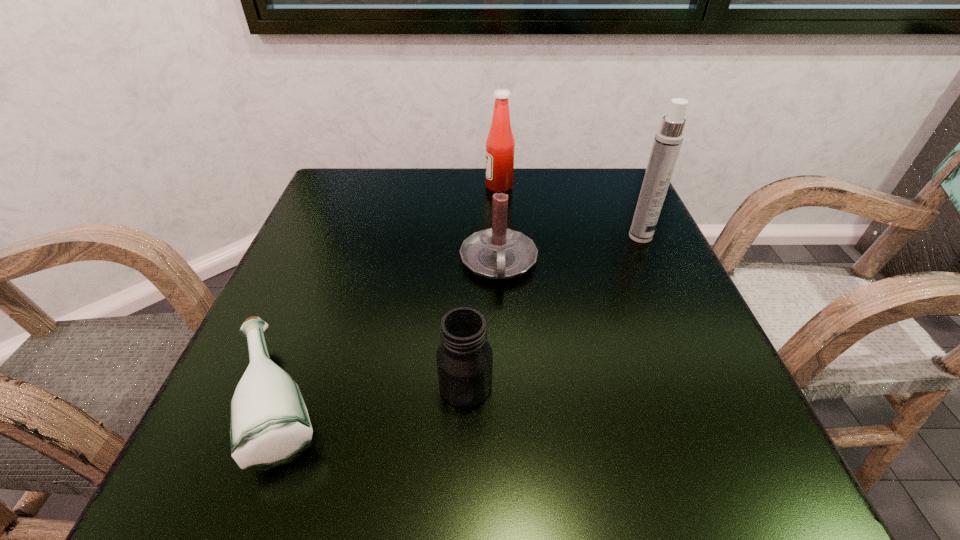
In the image, there is a desktop. At what (x,y) coordinates should I click in order to perform the action: click on free space at the far edge. Please return your answer as a coordinate pair (x, y). The width and height of the screenshot is (960, 540). Looking at the image, I should click on (389, 197).

Image resolution: width=960 pixels, height=540 pixels. I want to click on vacant space at the near edge of the desktop, so click(525, 494).

This screenshot has height=540, width=960. I want to click on vacant space at the left edge, so click(x=307, y=368).

In the image, there is a desktop. In order to click on vacant space at the right edge in this screenshot , I will do `click(606, 231)`.

This screenshot has width=960, height=540. Find the location of `vacant space at the far left corner of the desktop`. vacant space at the far left corner of the desktop is located at coordinates (343, 212).

What are the coordinates of `free spot at the far right corner of the desktop` in the screenshot? It's located at (607, 174).

Image resolution: width=960 pixels, height=540 pixels. In the image, there is a desktop. In order to click on vacant space at the near right corner in this screenshot , I will do `click(749, 469)`.

Find the location of a particular element. free space between the fourth shortest object and the jar is located at coordinates (482, 286).

Identify the location of vacant area between the jar and the leftmost object. The height and width of the screenshot is (540, 960). (373, 393).

I want to click on empty location between the farthest object and the leftmost object, so click(390, 293).